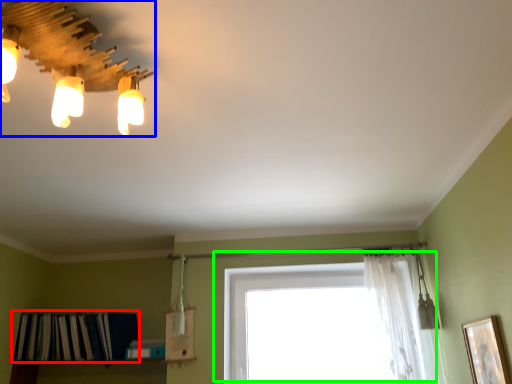
Question: Estimate the real-world distances between objects in this image. Which object is closer to shelf (highlighted by a red box), lamp (highlighted by a blue box) or window (highlighted by a green box)?

Choices:
 (A) lamp
 (B) window

Answer: (B)